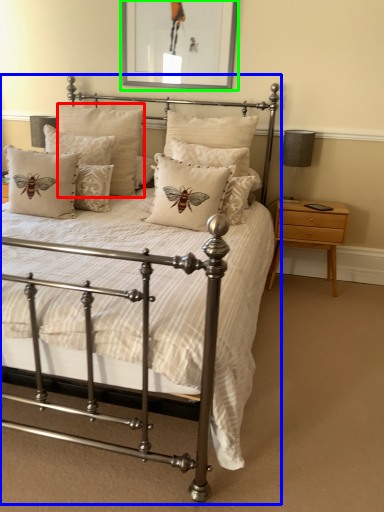
Question: Based on their relative distances, which object is farther from pillow (highlighted by a red box)? Choose from bed (highlighted by a blue box) and picture frame (highlighted by a green box).

Choices:
 (A) bed
 (B) picture frame

Answer: (A)